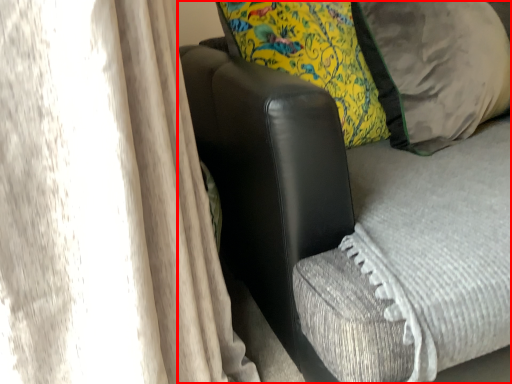
Question: From the image's perspective, where is furniture (annotated by the red box) located relative to pillow?

Choices:
 (A) below
 (B) above

Answer: (A)